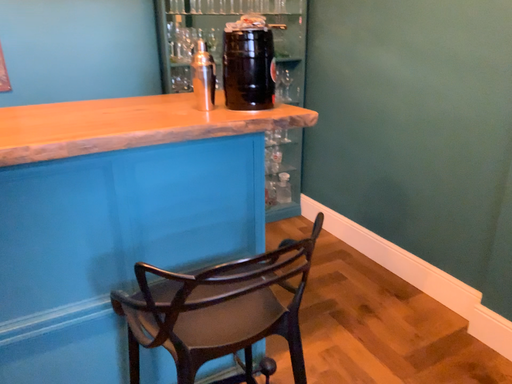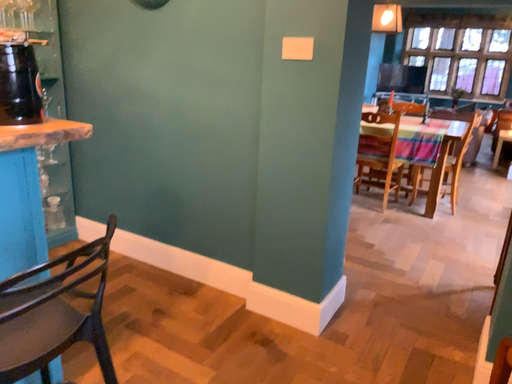
Question: How did the camera likely rotate when shooting the video?

Choices:
 (A) rotated right
 (B) rotated left

Answer: (A)